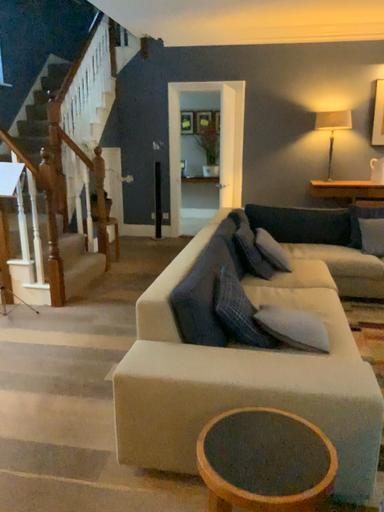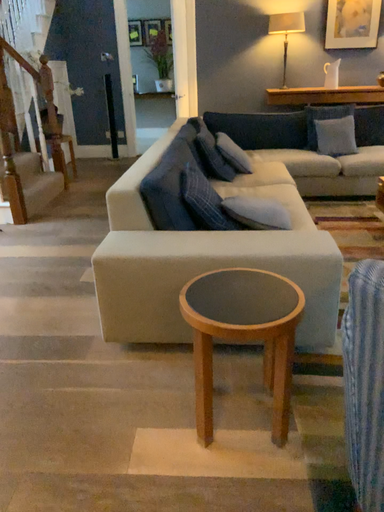
Question: How did the camera likely rotate when shooting the video?

Choices:
 (A) rotated downward
 (B) rotated upward

Answer: (A)